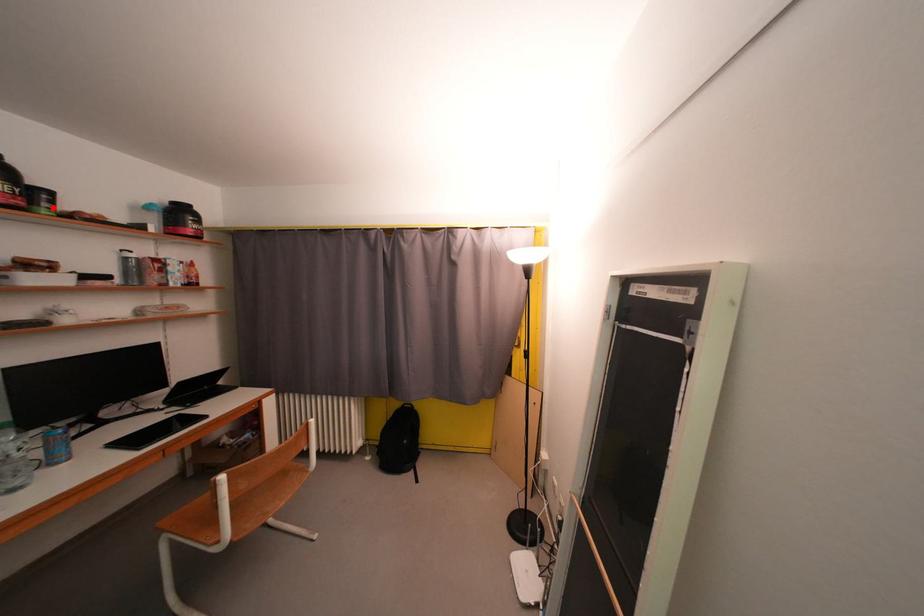
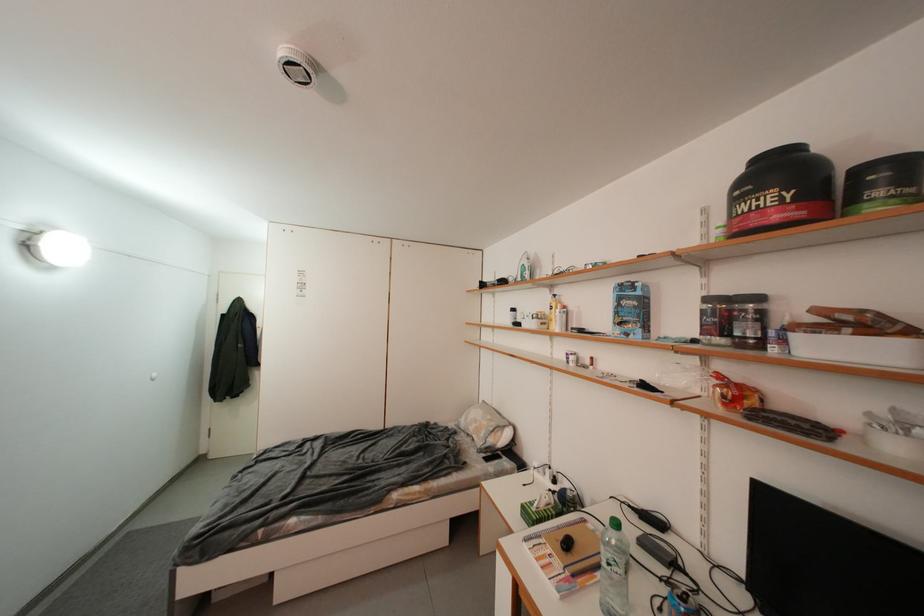
The point at the highlighted location is marked in the first image. Where is the corresponding point in the second image?

(886, 196)